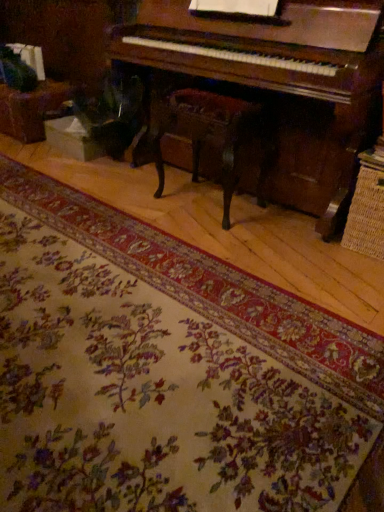
You are a GUI agent. You are given a task and a screenshot of the screen. Output one action in this format:
    pyautogui.click(x=<x>, y=<y>)
    Task: Click on the vacant space that is to the left of wooden polished chair at center
    The image size is (384, 512).
    Given the screenshot: What is the action you would take?
    pyautogui.click(x=141, y=200)